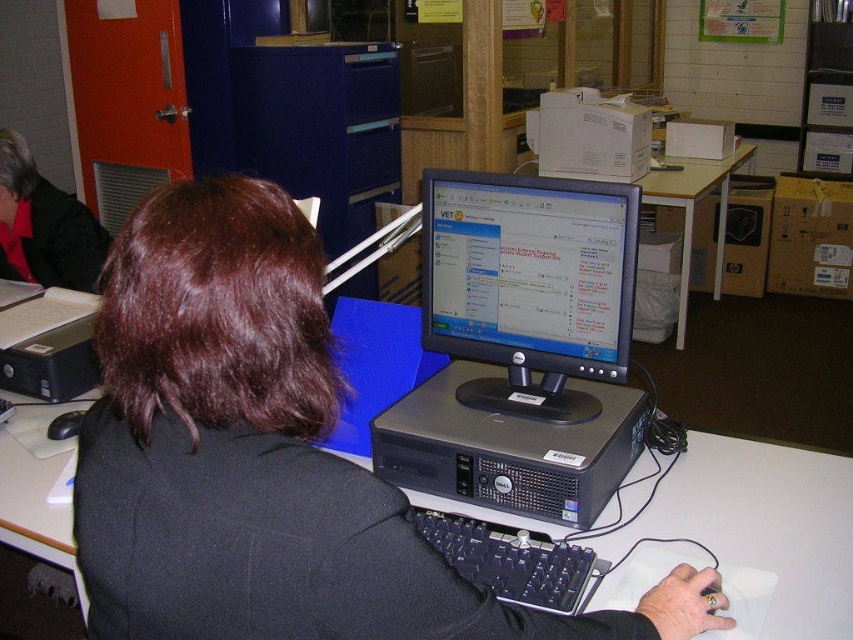
Who is more distant from viewer, (633, 234) or (35, 234)?

The point (35, 234) is more distant.

What do you see at coordinates (529, 269) in the screenshot? This screenshot has width=853, height=640. I see `matte black monitor at center` at bounding box center [529, 269].

Is point (582, 364) positioned before point (91, 262)?

Yes.

Locate an element on the screen. The height and width of the screenshot is (640, 853). matte black monitor at center is located at coordinates pos(529,269).

In the scene shown: Is matte black monitor at center wider than black matte mouse at lower left?

Indeed, matte black monitor at center has a greater width compared to black matte mouse at lower left.

You are a GUI agent. You are given a task and a screenshot of the screen. Output one action in this format:
    pyautogui.click(x=<x>, y=<y>)
    Task: Click on the matte black monitor at center
    The width and height of the screenshot is (853, 640).
    Given the screenshot: What is the action you would take?
    pyautogui.click(x=529, y=269)

Locate an element on the screen. matte black monitor at center is located at coordinates (529, 269).

This screenshot has width=853, height=640. What are the coordinates of `matte black monitor at center` in the screenshot? It's located at (529, 269).

Can you confirm if black matte jacket at center is shorter than matte black monitor at center?

No.

Between point (303, 250) and point (463, 253), which one is positioned behind?

Point (463, 253)

Locate an element on the screen. This screenshot has height=640, width=853. black matte jacket at center is located at coordinates (265, 458).